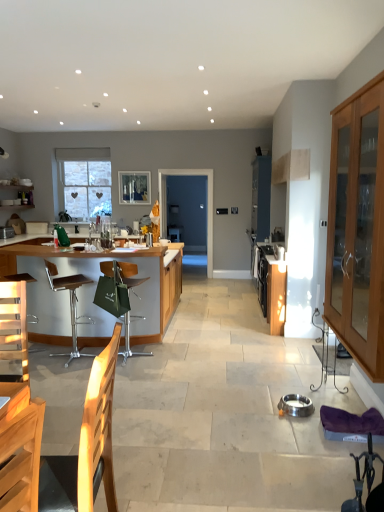
Question: Considering their positions, is brown leather bar stool at left, which is the 2th chair from right to left, located in front of or behind clear glass window screen at upper center?

Choices:
 (A) front
 (B) behind

Answer: (A)

Question: Based on their sizes in the image, would you say brown leather bar stool at left, which appears as the 1th chair when viewed from the left, is bigger or smaller than clear glass window screen at upper center?

Choices:
 (A) small
 (B) big

Answer: (B)

Question: Based on their relative distances, which object is farther from the wooden armchair at lower left?

Choices:
 (A) clear glass window screen at upper center
 (B) wooden bar counter at left, the first cabinetry when ordered from left to right
 (C) stainless steel oven at center-right, marked as the 2th appliance in a back-to-front arrangement
 (D) wooden cabinet at center, the 2th cabinetry when ordered from left to right
 (E) transparent glass door at center

Answer: (E)

Question: Which of these objects is positioned farthest from the wooden cabinet at center, which ranks as the 2th cabinetry in right-to-left order?

Choices:
 (A) light brown wooden cabinet at right, the first cabinetry from the right
 (B) silver metallic bowl at center, which appears as the 3th appliance when viewed from the back
 (C) metallic silver toaster at left, arranged as the first appliance when viewed from the left
 (D) clear glass window at upper left
 (E) stainless steel oven at center-right, which ranks as the second appliance in bottom-to-top order

Answer: (D)